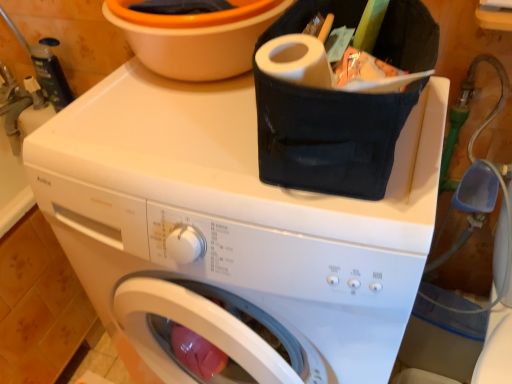
Question: Based on their positions, is orange plastic basin at upper center located to the left or right of white matte washing machine at upper center?

Choices:
 (A) left
 (B) right

Answer: (A)

Question: In terms of width, does orange plastic basin at upper center look wider or thinner when compared to white matte washing machine at upper center?

Choices:
 (A) wide
 (B) thin

Answer: (B)

Question: In terms of size, does orange plastic basin at upper center appear bigger or smaller than white matte washing machine at upper center?

Choices:
 (A) big
 (B) small

Answer: (B)

Question: In terms of height, does white matte washing machine at upper center look taller or shorter compared to orange plastic basin at upper center?

Choices:
 (A) tall
 (B) short

Answer: (A)

Question: Is white matte washing machine at upper center to the left or to the right of orange plastic basin at upper center in the image?

Choices:
 (A) right
 (B) left

Answer: (A)

Question: Is white matte washing machine at upper center in front of or behind orange plastic basin at upper center in the image?

Choices:
 (A) front
 (B) behind

Answer: (A)

Question: Looking at their shapes, would you say white matte washing machine at upper center is wider or thinner than orange plastic basin at upper center?

Choices:
 (A) wide
 (B) thin

Answer: (A)